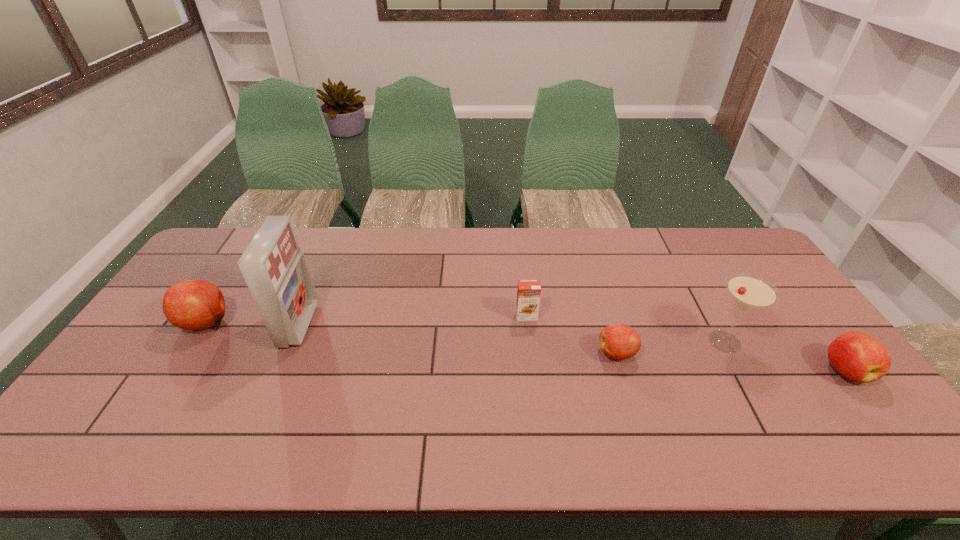
I want to click on vacant position for inserting another apple evenly, so [404, 337].